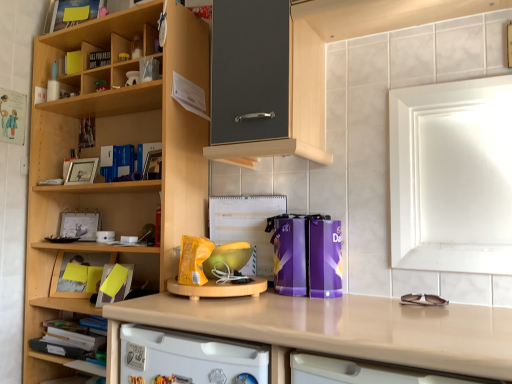
The image size is (512, 384). I want to click on free location above beige laminate countertop at center (from a real-world perspective), so click(x=406, y=324).